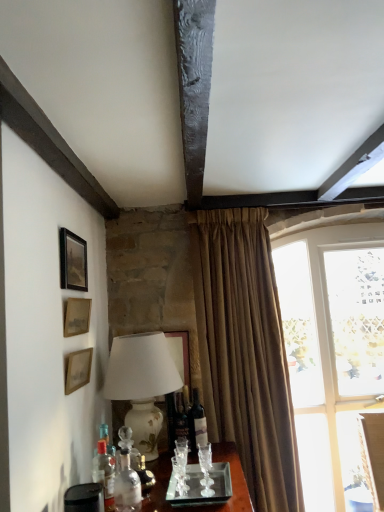
Question: Should I look upward or downward to see matte glass wine bottle at center?

Choices:
 (A) up
 (B) down

Answer: (B)

Question: From a real-world perspective, is clear glass bottle at lower center, acting as the 3th bottle starting from the back, located higher than beige textured curtain at center?

Choices:
 (A) no
 (B) yes

Answer: (A)

Question: Is clear glass bottle at lower center, the second bottle from the right, far away from beige textured curtain at center?

Choices:
 (A) no
 (B) yes

Answer: (A)

Question: From the image's perspective, is clear glass bottle at lower center, positioned as the 1th bottle in front-to-back order, located beneath beige textured curtain at center?

Choices:
 (A) no
 (B) yes

Answer: (B)

Question: Can you confirm if clear glass bottle at lower center, which is the 2th bottle from left to right, is positioned to the right of beige textured curtain at center?

Choices:
 (A) no
 (B) yes

Answer: (A)

Question: Is beige textured curtain at center at the back of clear glass bottle at lower center, which is the 2th bottle from left to right?

Choices:
 (A) no
 (B) yes

Answer: (A)

Question: Can you confirm if clear glass bottle at lower center, positioned as the 1th bottle in front-to-back order, is taller than beige textured curtain at center?

Choices:
 (A) no
 (B) yes

Answer: (A)

Question: Is matte black picture frame at upper left, which appears as the first picture frame when viewed from the top, positioned in front of clear glass bottle at lower left, which appears as the 3th bottle when viewed from the right?

Choices:
 (A) yes
 (B) no

Answer: (B)

Question: Is matte black picture frame at upper left, which appears as the first picture frame when viewed from the top, aimed at clear glass bottle at lower left, the 1th bottle in the left-to-right sequence?

Choices:
 (A) no
 (B) yes

Answer: (A)

Question: Would you say clear glass bottle at lower left, which appears as the second bottle when viewed from the back, is part of matte black picture frame at upper left, the 3th picture frame positioned from the bottom,'s contents?

Choices:
 (A) yes
 (B) no

Answer: (B)

Question: Can you confirm if matte black picture frame at upper left, the 3th picture frame positioned from the bottom, is positioned to the left of clear glass bottle at lower left, which appears as the second bottle when viewed from the back?

Choices:
 (A) yes
 (B) no

Answer: (A)

Question: Does matte black picture frame at upper left, the 3th picture frame positioned from the bottom, have a greater width compared to clear glass bottle at lower left, which appears as the second bottle when viewed from the back?

Choices:
 (A) no
 (B) yes

Answer: (A)

Question: Can you confirm if matte black picture frame at upper left, which appears as the first picture frame when viewed from the top, is taller than clear glass bottle at lower left, which appears as the 3th bottle when viewed from the right?

Choices:
 (A) no
 (B) yes

Answer: (A)

Question: Is clear glass window at right positioned with its back to wooden picture frame at left, arranged as the 1th picture frame when ordered from the bottom?

Choices:
 (A) no
 (B) yes

Answer: (A)